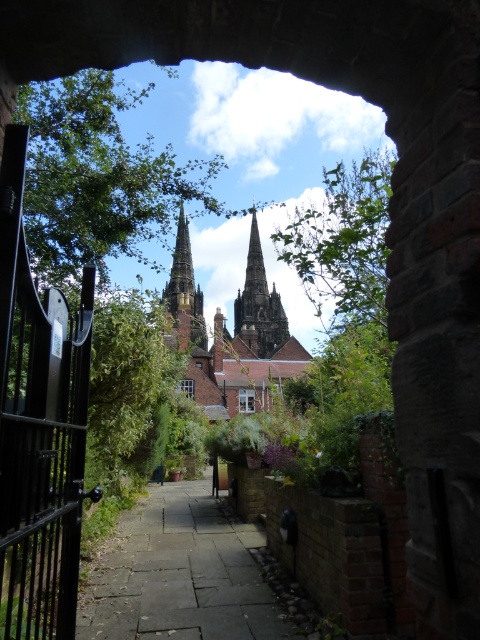
You are standing at the entrance of the archway in the image. There is a point marked at coordinates (229, 337). Which object does this point correspond to?

The point at coordinates (229, 337) corresponds to the brown brick church at center.

Consider the image. You are standing in the archway looking towards the historic building. There are two points marked in the scene. The first point is at coordinate point (x=26, y=576) and the second is at point (x=126, y=532). Which point is closer to you?

Point (x=26, y=576) is closer to the camera than point (x=126, y=532).

You are standing in front of the stone archway and want to take a photo of the brown brick church at center and the brown stone spire at center. Which one should you focus on first if you want both to be in sharp focus?

Since the brown brick church at center is closer to the viewer than the brown stone spire at center, you should focus on the brown brick church at center first to ensure both are in sharp focus.